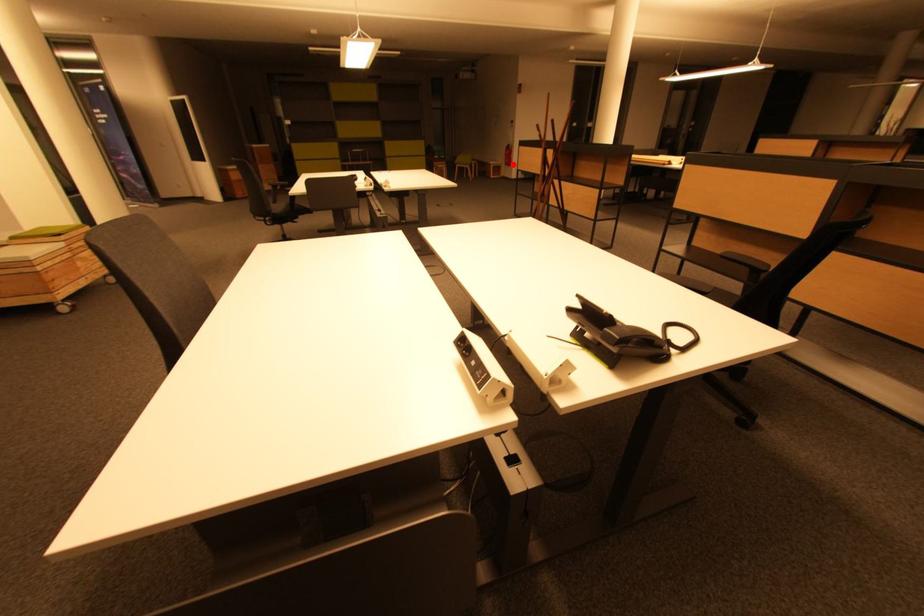
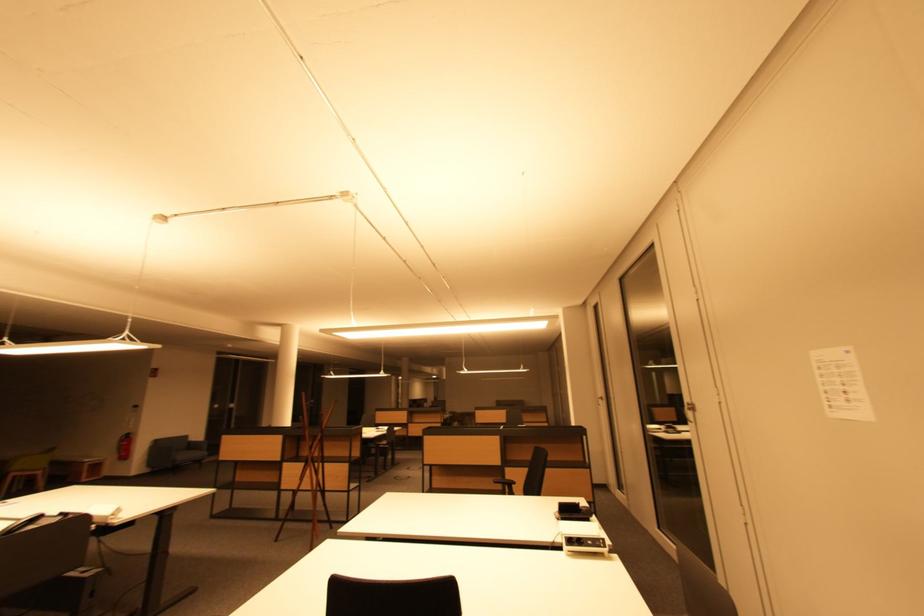
Locate, in the second image, the point that corresponds to the highlighted location in the first image.

(128, 458)